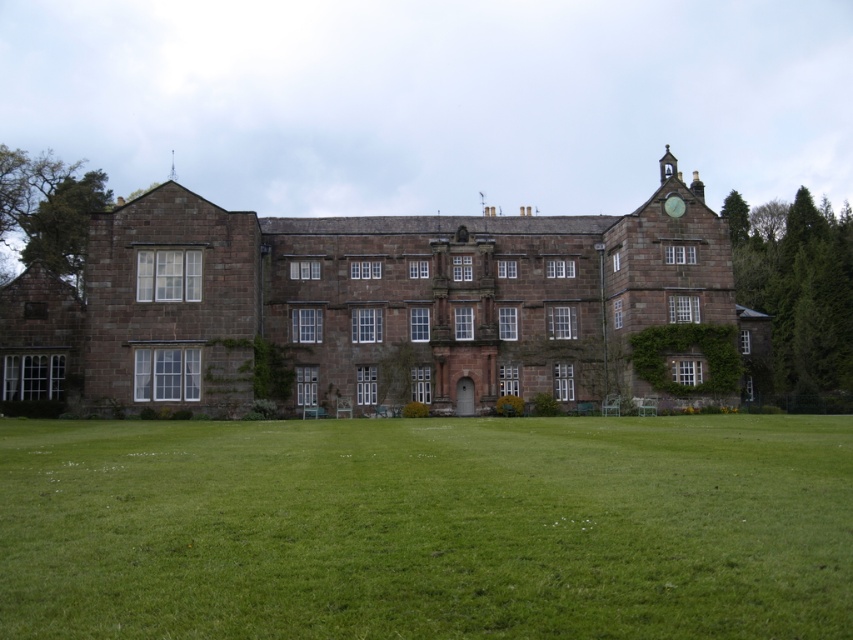
You are planning to host a picnic on the green grass at lower center near the brown stone mansion at center. Considering the space available, will there be enough room for a picnic blanket and a small cooler?

The green grass at lower center has a lesser width compared to the brown stone mansion at center, so there might not be sufficient space for a picnic blanket and a small cooler.

You are standing on the green grass at lower center and want to walk to the brown stone mansion at center. Which direction should you head to reach it?

Since the green grass at lower center is positioned on the right side of the brown stone mansion at center, you should head to the left to reach the mansion.